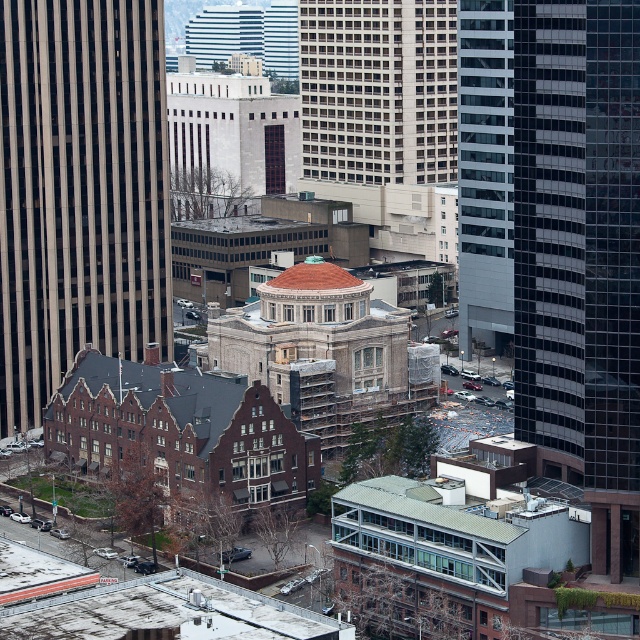
You are a drone operator trying to capture aerial footage of the city. Your drone is currently hovering above the beige glass skyscraper at left and the beige stone building at center. To ensure the best shot, you need to know which building is closer to the camera. Which one is it?

The beige glass skyscraper at left is closer to the viewer than the beige stone building at center, so the beige glass skyscraper at left will appear larger and closer in the footage.